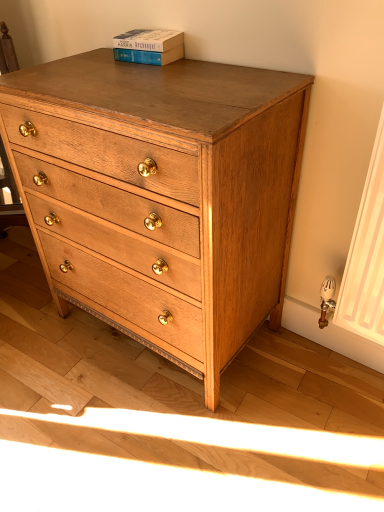
The width and height of the screenshot is (384, 512). What do you see at coordinates (161, 195) in the screenshot?
I see `natural wood chest of drawers at center` at bounding box center [161, 195].

The width and height of the screenshot is (384, 512). What are the coordinates of `natural wood chest of drawers at center` in the screenshot? It's located at (161, 195).

Image resolution: width=384 pixels, height=512 pixels. Describe the element at coordinates (149, 46) in the screenshot. I see `blue cardboard book at upper center` at that location.

Where is `blue cardboard book at upper center`? The width and height of the screenshot is (384, 512). blue cardboard book at upper center is located at coordinates (149, 46).

This screenshot has width=384, height=512. I want to click on natural wood chest of drawers at center, so (x=161, y=195).

Which is more to the left, blue cardboard book at upper center or natural wood chest of drawers at center?

Positioned to the left is blue cardboard book at upper center.

In the scene shown: Considering their positions, is blue cardboard book at upper center located in front of or behind natural wood chest of drawers at center?

blue cardboard book at upper center is positioned farther from the viewer than natural wood chest of drawers at center.

Does point (165, 42) lie in front of point (150, 244)?

No, it is behind (150, 244).

From the image's perspective, is blue cardboard book at upper center above or below natural wood chest of drawers at center?

blue cardboard book at upper center is above natural wood chest of drawers at center.

From a real-world perspective, which object stands above the other?

blue cardboard book at upper center, from a real-world perspective.

Considering the relative sizes of blue cardboard book at upper center and natural wood chest of drawers at center in the image provided, is blue cardboard book at upper center thinner than natural wood chest of drawers at center?

Correct, the width of blue cardboard book at upper center is less than that of natural wood chest of drawers at center.

Can you confirm if blue cardboard book at upper center is shorter than natural wood chest of drawers at center?

Yes.

Is blue cardboard book at upper center bigger than natural wood chest of drawers at center?

No, blue cardboard book at upper center is not bigger than natural wood chest of drawers at center.

Could natural wood chest of drawers at center be considered to be inside blue cardboard book at upper center?

No, natural wood chest of drawers at center is not surrounded by blue cardboard book at upper center.

Would you say blue cardboard book at upper center is a long distance from natural wood chest of drawers at center?

No, blue cardboard book at upper center is not far from natural wood chest of drawers at center.

In the scene shown: Is blue cardboard book at upper center facing away from natural wood chest of drawers at center?

blue cardboard book at upper center is not turned away from natural wood chest of drawers at center.

Can you tell me how much blue cardboard book at upper center and natural wood chest of drawers at center differ in facing direction?

2.65 degrees.

Locate an element on the screen. paperback book behind the natural wood chest of drawers at center is located at coordinates (149, 46).

Does natural wood chest of drawers at center appear on the right side of blue cardboard book at upper center?

Indeed, natural wood chest of drawers at center is positioned on the right side of blue cardboard book at upper center.

Consider the image. Between natural wood chest of drawers at center and blue cardboard book at upper center, which one is positioned behind?

blue cardboard book at upper center.

Between point (207, 208) and point (151, 63), which one is positioned in front?

The point (207, 208) is closer.

Based on the photo, from the image's perspective, is natural wood chest of drawers at center above or below blue cardboard book at upper center?

natural wood chest of drawers at center is below blue cardboard book at upper center.

From a real-world perspective, which object stands above the other?

blue cardboard book at upper center.

Considering the relative sizes of natural wood chest of drawers at center and blue cardboard book at upper center in the image provided, is natural wood chest of drawers at center thinner than blue cardboard book at upper center?

Incorrect, the width of natural wood chest of drawers at center is not less than that of blue cardboard book at upper center.

Considering the relative sizes of natural wood chest of drawers at center and blue cardboard book at upper center in the image provided, is natural wood chest of drawers at center shorter than blue cardboard book at upper center?

No, natural wood chest of drawers at center is not shorter than blue cardboard book at upper center.

Looking at this image, considering the sizes of natural wood chest of drawers at center and blue cardboard book at upper center in the image, is natural wood chest of drawers at center bigger or smaller than blue cardboard book at upper center?

Considering their sizes, natural wood chest of drawers at center takes up more space than blue cardboard book at upper center.

Does natural wood chest of drawers at center contain blue cardboard book at upper center?

Definitely not — blue cardboard book at upper center is not inside natural wood chest of drawers at center.

Would you consider natural wood chest of drawers at center to be distant from blue cardboard book at upper center?

No, there isn't a large distance between natural wood chest of drawers at center and blue cardboard book at upper center.

Consider the image. Is natural wood chest of drawers at center oriented towards blue cardboard book at upper center?

No.

Locate an element on the screen. Image resolution: width=384 pixels, height=512 pixels. the chest of drawers in front of the blue cardboard book at upper center is located at coordinates (161, 195).

I want to click on chest of drawers below the blue cardboard book at upper center (from a real-world perspective), so click(x=161, y=195).

Where is `chest of drawers that is on the right side of blue cardboard book at upper center`? The width and height of the screenshot is (384, 512). chest of drawers that is on the right side of blue cardboard book at upper center is located at coordinates (161, 195).